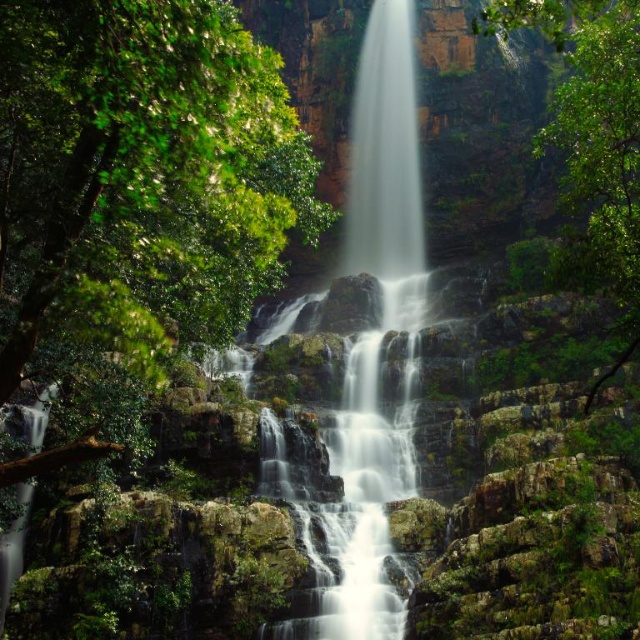
You are standing in the forest and want to take a photo of the white smooth waterfall at center and the green leafy tree at right. If you move to your left, will the waterfall move to the right side of the tree in your viewfinder?

Yes, moving to your left would shift your perspective so that the white smooth waterfall at center appears to the left of the green leafy tree at right in your viewfinder, as their relative positions depend on your viewpoint.

You are a hiker standing at the base of the white smooth waterfall at center and looking up. There is a green leafy tree at upper left in your view. Which object appears taller from your perspective?

The white smooth waterfall at center appears taller than the green leafy tree at upper left from your perspective because the green leafy tree at upper left has a lesser height compared to the white smooth waterfall at center.